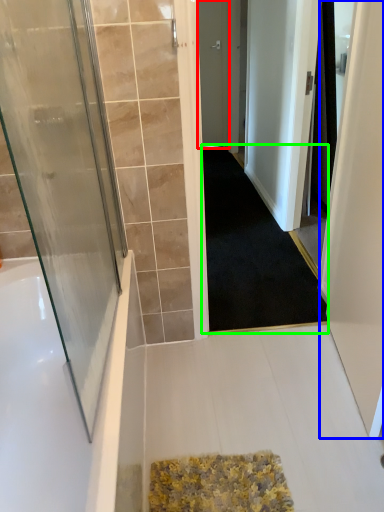
Question: Which is farther away from door (highlighted by a red box)? screen door (highlighted by a blue box) or doormat (highlighted by a green box)?

Choices:
 (A) screen door
 (B) doormat

Answer: (A)